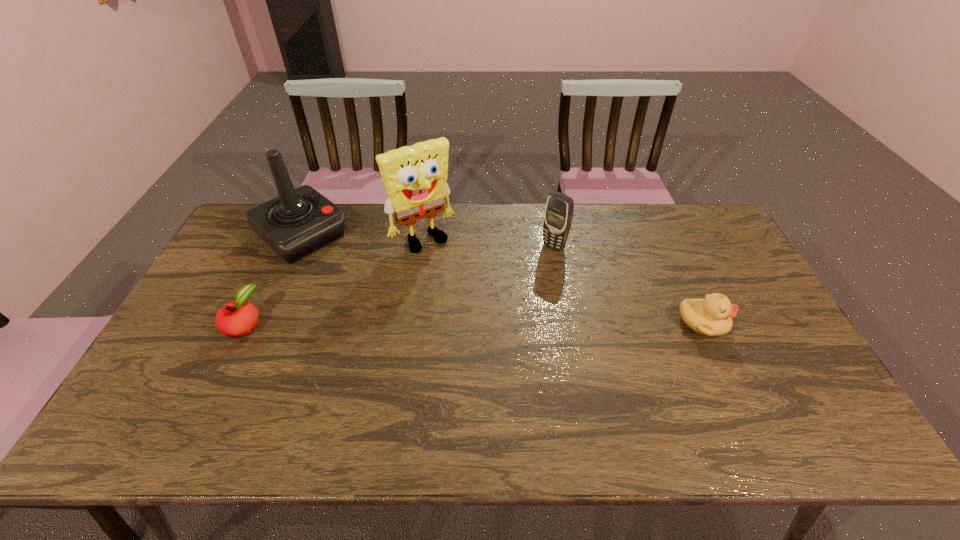
At what (x,y) coordinates should I click in order to perform the action: click on vacant spot on the desktop that is between the shortest object and the duckling and is positioned on the face of the sponge. Please return your answer as a coordinate pair (x, y). This screenshot has width=960, height=540. Looking at the image, I should click on (488, 323).

Where is `free spot on the desktop that is between the apple and the rightmost object and is positioned on the front face of the third tallest object`? free spot on the desktop that is between the apple and the rightmost object and is positioned on the front face of the third tallest object is located at coordinates (471, 323).

Image resolution: width=960 pixels, height=540 pixels. Find the location of `vacant space on the desktop that is between the shortest object and the duckling and is positioned on the front-facing side of the joystick`. vacant space on the desktop that is between the shortest object and the duckling and is positioned on the front-facing side of the joystick is located at coordinates (405, 323).